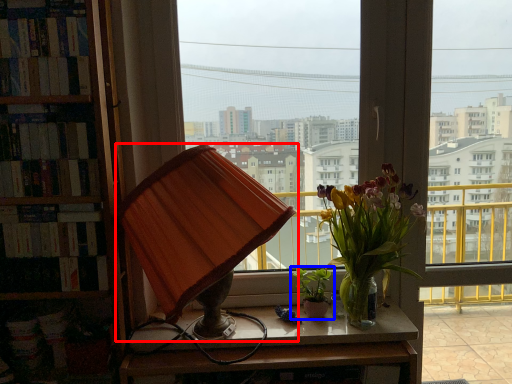
Question: Which point is closer to the camera, lamp (highlighted by a red box) or houseplant (highlighted by a blue box)?

Choices:
 (A) lamp
 (B) houseplant

Answer: (A)